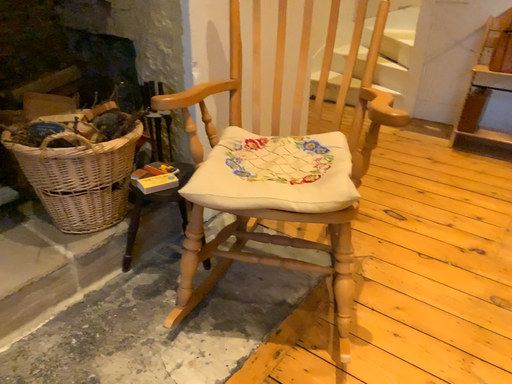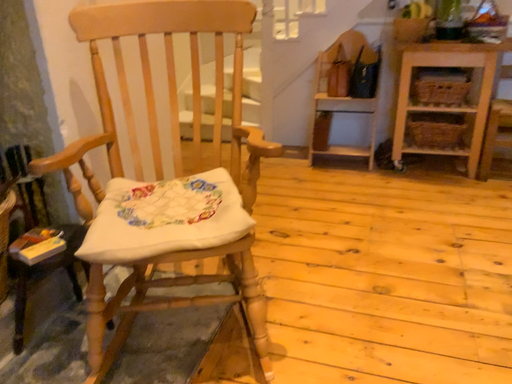
Question: How did the camera likely rotate when shooting the video?

Choices:
 (A) rotated left
 (B) rotated right

Answer: (B)